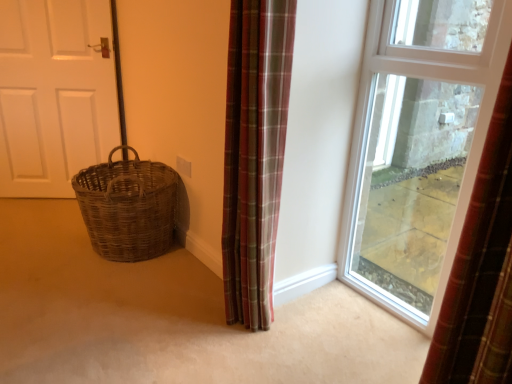
Question: Is clear glass window at center located within plaid fabric curtain at center?

Choices:
 (A) yes
 (B) no

Answer: (B)

Question: Are plaid fabric curtain at center and clear glass window at center making contact?

Choices:
 (A) yes
 (B) no

Answer: (B)

Question: Is plaid fabric curtain at center positioned with its back to clear glass window at center?

Choices:
 (A) no
 (B) yes

Answer: (B)

Question: Is the position of plaid fabric curtain at center less distant than that of clear glass window at center?

Choices:
 (A) no
 (B) yes

Answer: (B)

Question: Considering the relative sizes of plaid fabric curtain at center and clear glass window at center in the image provided, is plaid fabric curtain at center smaller than clear glass window at center?

Choices:
 (A) no
 (B) yes

Answer: (A)

Question: Relative to clear glass window at center, is white matte door at left in front or behind?

Choices:
 (A) front
 (B) behind

Answer: (B)

Question: Considering the positions of white matte door at left and clear glass window at center in the image, is white matte door at left taller or shorter than clear glass window at center?

Choices:
 (A) short
 (B) tall

Answer: (A)

Question: From the image's perspective, is white matte door at left positioned above or below clear glass window at center?

Choices:
 (A) above
 (B) below

Answer: (A)

Question: From a real-world perspective, is white matte door at left positioned above or below clear glass window at center?

Choices:
 (A) below
 (B) above

Answer: (A)

Question: In terms of size, does white matte door at left appear bigger or smaller than woven wicker basket at left?

Choices:
 (A) big
 (B) small

Answer: (B)

Question: Is white matte door at left inside the boundaries of woven wicker basket at left, or outside?

Choices:
 (A) inside
 (B) outside

Answer: (B)

Question: In the image, is white matte door at left positioned in front of or behind woven wicker basket at left?

Choices:
 (A) front
 (B) behind

Answer: (B)

Question: Considering the positions of white matte door at left and woven wicker basket at left in the image, is white matte door at left taller or shorter than woven wicker basket at left?

Choices:
 (A) tall
 (B) short

Answer: (A)

Question: Considering the positions of woven wicker basket at left and woven brown basket at lower left in the image, is woven wicker basket at left taller or shorter than woven brown basket at lower left?

Choices:
 (A) short
 (B) tall

Answer: (A)

Question: Looking at their shapes, would you say woven wicker basket at left is wider or thinner than woven brown basket at lower left?

Choices:
 (A) thin
 (B) wide

Answer: (B)